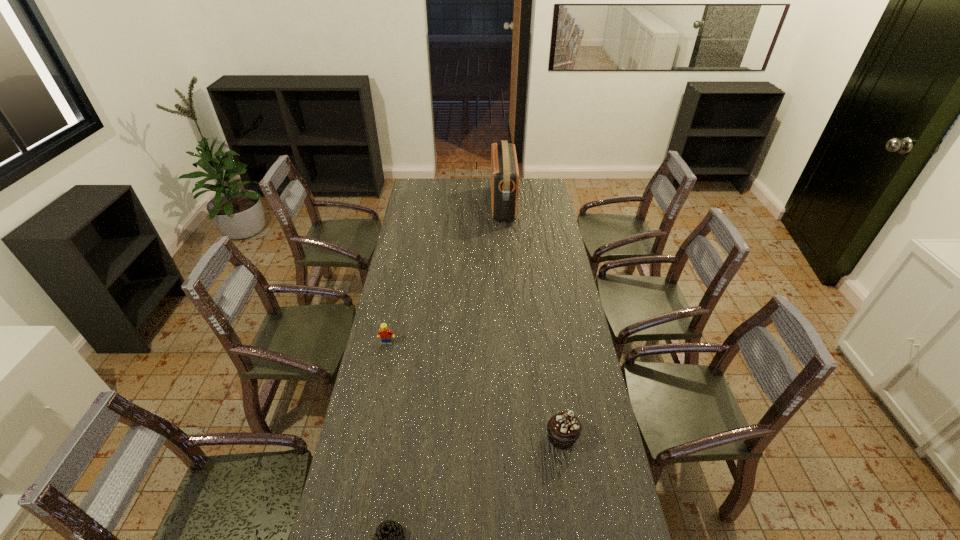
Identify the location of free space located on the front-facing side of the Lego. (374, 404).

Find the location of a particular element. object at the far edge is located at coordinates (504, 168).

This screenshot has width=960, height=540. Identify the location of object present at the left edge. (384, 333).

Where is `object situated at the right edge`? This screenshot has width=960, height=540. object situated at the right edge is located at coordinates (564, 428).

In the image, there is a desktop. Identify the location of free space at the far edge. (475, 190).

In the image, there is a desktop. What are the coordinates of `vacant space at the left edge` in the screenshot? It's located at (389, 307).

The height and width of the screenshot is (540, 960). In the image, there is a desktop. What are the coordinates of `vacant region at the right edge` in the screenshot? It's located at (544, 270).

Where is `free space at the far left corner of the desktop`? free space at the far left corner of the desktop is located at coordinates (435, 187).

This screenshot has height=540, width=960. I want to click on blank area at the far right corner, so click(x=533, y=184).

Where is `free space between the third object from left to right and the cupcake`? free space between the third object from left to right and the cupcake is located at coordinates (533, 321).